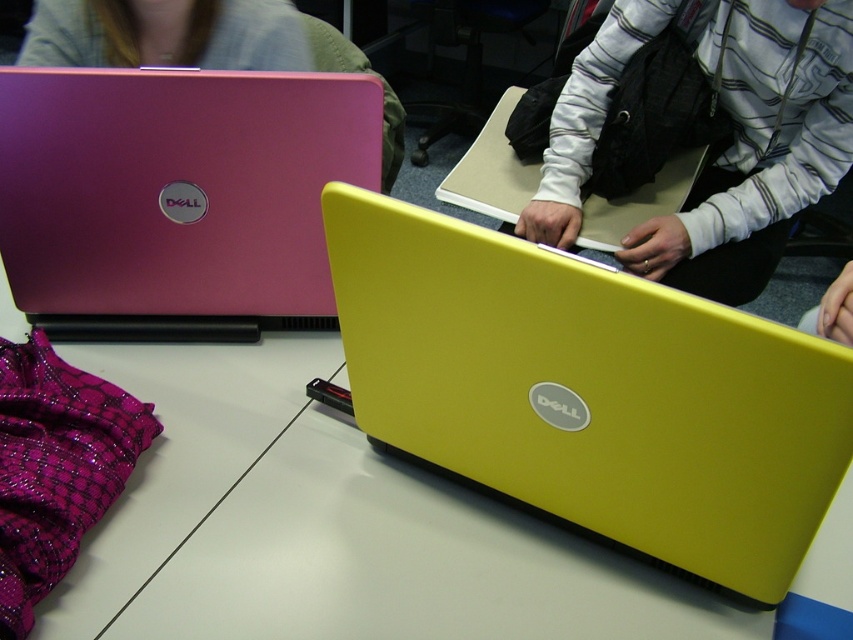
Does yellow matte laptop at center have a greater height compared to matte pink laptop at left?

Yes, yellow matte laptop at center is taller than matte pink laptop at left.

Is yellow matte laptop at center below matte pink laptop at left?

Indeed, yellow matte laptop at center is positioned under matte pink laptop at left.

What do you see at coordinates (590, 392) in the screenshot? The image size is (853, 640). I see `yellow matte laptop at center` at bounding box center [590, 392].

The width and height of the screenshot is (853, 640). In order to click on yellow matte laptop at center in this screenshot , I will do `click(590, 392)`.

Which is more to the right, yellow matte laptop at center or white striped hoodie at center?

From the viewer's perspective, white striped hoodie at center appears more on the right side.

Is point (712, 358) farther from viewer compared to point (767, 204)?

No.

At what (x,y) coordinates should I click in order to perform the action: click on yellow matte laptop at center. Please return your answer as a coordinate pair (x, y). Image resolution: width=853 pixels, height=640 pixels. Looking at the image, I should click on click(x=590, y=392).

Is yellow matte laptop at center positioned at the back of matte pink laptop at upper left?

No, yellow matte laptop at center is in front of matte pink laptop at upper left.

Who is more forward, (601, 504) or (234, 67)?

Point (601, 504)

In order to click on yellow matte laptop at center in this screenshot , I will do `click(590, 392)`.